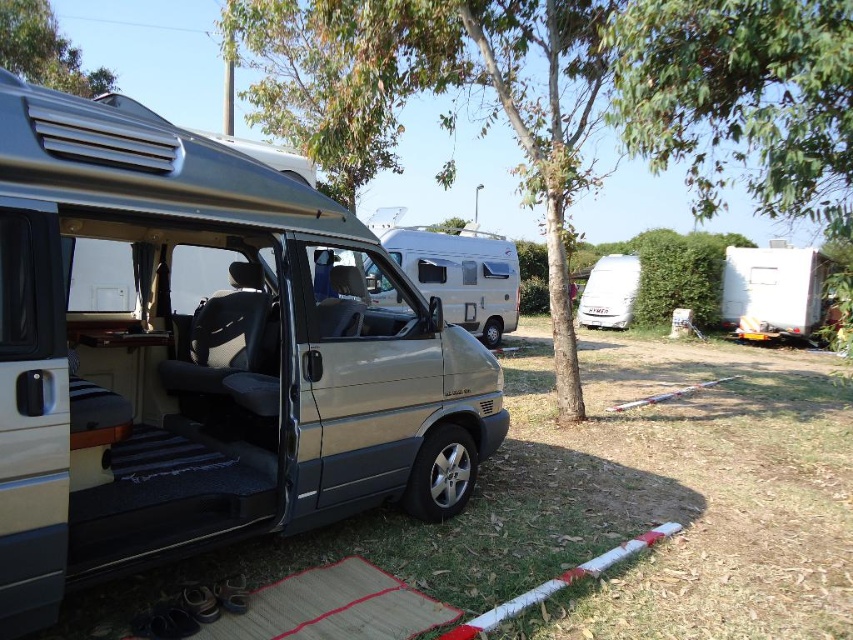
Question: Which point is closer to the camera taking this photo?

Choices:
 (A) (767, 252)
 (B) (589, 305)
 (C) (473, 292)
 (D) (378, 301)

Answer: (D)

Question: Is the position of silver metallic van at center more distant than that of white matte camper at right?

Choices:
 (A) no
 (B) yes

Answer: (A)

Question: Which point is closer to the camera?

Choices:
 (A) (775, 298)
 (B) (488, 314)

Answer: (B)

Question: Which object is the farthest from the silver metallic van at center?

Choices:
 (A) metallic silver minivan at center
 (B) white matte camper at right
 (C) white matte van at center

Answer: (B)

Question: Does metallic silver minivan at center come in front of white matte camper at right?

Choices:
 (A) no
 (B) yes

Answer: (B)

Question: Is metallic silver minivan at center wider than silver metallic van at center?

Choices:
 (A) no
 (B) yes

Answer: (B)